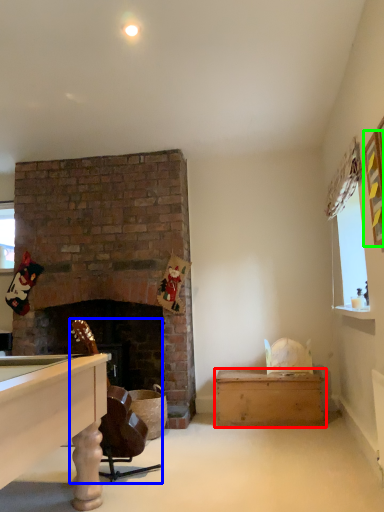
Question: Which object is the closest to the table (highlighted by a red box)? Choose among these: rocking chair (highlighted by a blue box) or picture frame (highlighted by a green box).

Choices:
 (A) rocking chair
 (B) picture frame

Answer: (A)